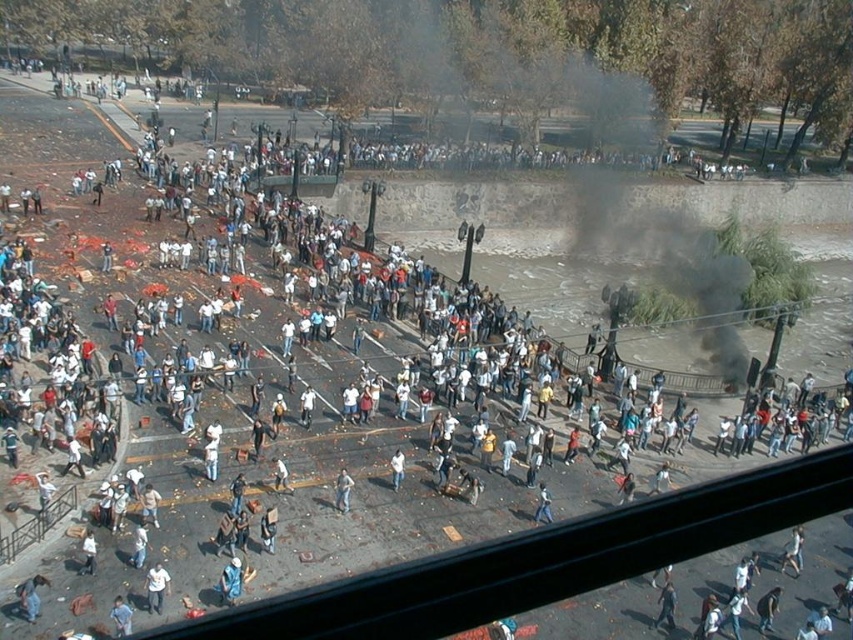
Question: Is blue denim jeans at lower center to the right of blue denim jeans at lower left from the viewer's perspective?

Choices:
 (A) yes
 (B) no

Answer: (A)

Question: Among these objects, which one is nearest to the camera?

Choices:
 (A) light brown leather jacket at center
 (B) blue jeans at lower center
 (C) white matte shirt at center
 (D) blue denim jeans at lower center

Answer: (D)

Question: Which of the following is the farthest from the observer?

Choices:
 (A) white cotton shirt at lower center
 (B) light brown leather jacket at center
 (C) white matte person at lower left
 (D) white matte shirt at center

Answer: (D)

Question: Is light brown leather jacket at center below white matte shirt at center?

Choices:
 (A) no
 (B) yes

Answer: (B)

Question: Is dark blue jeans at lower center to the left of light brown leather jacket at center from the viewer's perspective?

Choices:
 (A) no
 (B) yes

Answer: (B)

Question: Which object is positioned farthest from the blue denim jeans at lower center?

Choices:
 (A) blue denim jeans at lower left
 (B) light brown leather jacket at center
 (C) dark blue jeans at lower center
 (D) white matte shirt at center

Answer: (D)